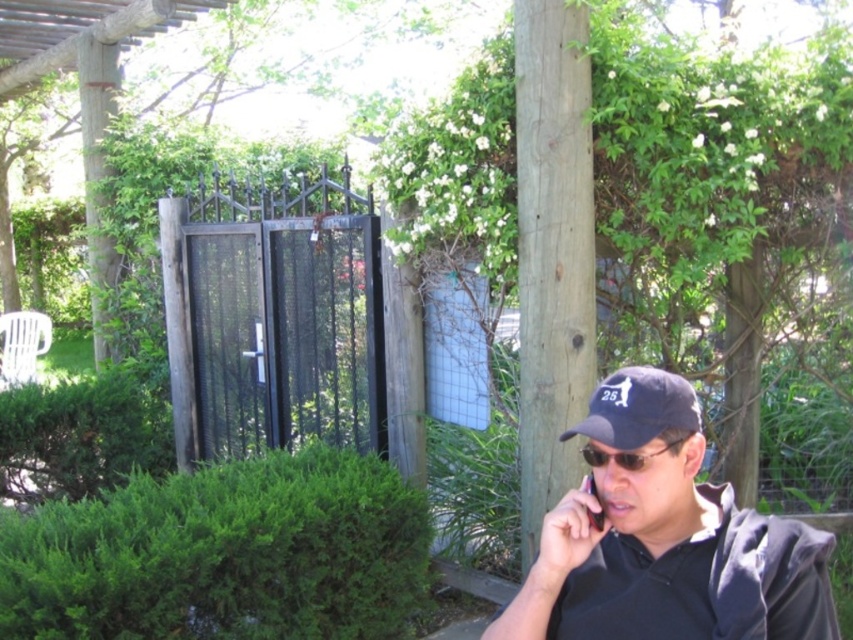
Question: Is sunglasses at center wider than black plastic phone at lower right?

Choices:
 (A) yes
 (B) no

Answer: (A)

Question: Which point is farther to the camera?

Choices:
 (A) navy blue fabric baseball cap at upper right
 (B) matte black cap at center
 (C) green leafy hedge at lower left

Answer: (C)

Question: Which point is closer to the camera?

Choices:
 (A) (605, 422)
 (B) (637, 467)

Answer: (B)

Question: Does sunglasses at center appear on the right side of black plastic phone at lower right?

Choices:
 (A) no
 (B) yes

Answer: (B)

Question: Does green leafy hedge at lower left have a smaller size compared to navy blue fabric baseball cap at upper right?

Choices:
 (A) yes
 (B) no

Answer: (B)

Question: Estimate the real-world distances between objects in this image. Which object is closer to the green leafy hedge at lower left?

Choices:
 (A) navy blue fabric baseball cap at upper right
 (B) sunglasses at center
 (C) black plastic phone at lower right
 (D) matte black cap at center

Answer: (D)